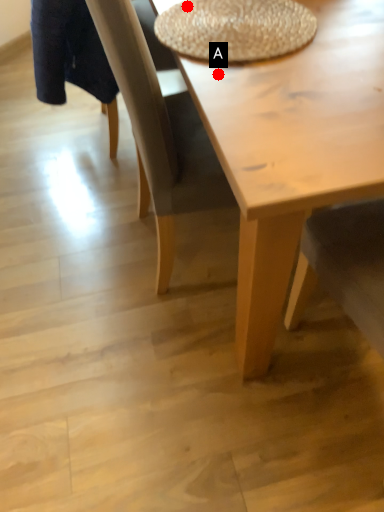
Question: Two points are circled on the image, labeled by A and B beside each circle. Which of the following is the closest to the observer?

Choices:
 (A) A is closer
 (B) B is closer

Answer: (A)